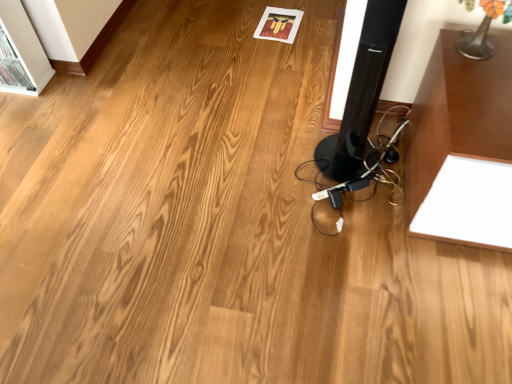
Question: Does metallic silver table lamp at upper right have a lesser width compared to black glossy speaker at center?

Choices:
 (A) yes
 (B) no

Answer: (A)

Question: Is metallic silver table lamp at upper right turned away from black glossy speaker at center?

Choices:
 (A) yes
 (B) no

Answer: (B)

Question: Does metallic silver table lamp at upper right have a greater width compared to black glossy speaker at center?

Choices:
 (A) yes
 (B) no

Answer: (B)

Question: Is metallic silver table lamp at upper right surrounding black glossy speaker at center?

Choices:
 (A) no
 (B) yes

Answer: (A)

Question: Is the depth of metallic silver table lamp at upper right greater than that of black glossy speaker at center?

Choices:
 (A) no
 (B) yes

Answer: (B)

Question: Considering the relative positions of metallic silver table lamp at upper right and black glossy speaker at center in the image provided, is metallic silver table lamp at upper right to the right of black glossy speaker at center from the viewer's perspective?

Choices:
 (A) no
 (B) yes

Answer: (B)

Question: Is black glossy speaker at center to the right of metallic silver table lamp at upper right from the viewer's perspective?

Choices:
 (A) yes
 (B) no

Answer: (B)

Question: Is black glossy speaker at center not near metallic silver table lamp at upper right?

Choices:
 (A) no
 (B) yes

Answer: (A)

Question: Considering the relative sizes of black glossy speaker at center and metallic silver table lamp at upper right in the image provided, is black glossy speaker at center thinner than metallic silver table lamp at upper right?

Choices:
 (A) yes
 (B) no

Answer: (B)

Question: From a real-world perspective, does black glossy speaker at center stand above metallic silver table lamp at upper right?

Choices:
 (A) no
 (B) yes

Answer: (A)

Question: Can metallic silver table lamp at upper right be found inside black glossy speaker at center?

Choices:
 (A) yes
 (B) no

Answer: (B)

Question: Is black glossy speaker at center bigger than metallic silver table lamp at upper right?

Choices:
 (A) no
 (B) yes

Answer: (B)

Question: From a real-world perspective, is metallic silver table lamp at upper right physically located above or below black glossy speaker at center?

Choices:
 (A) below
 (B) above

Answer: (B)